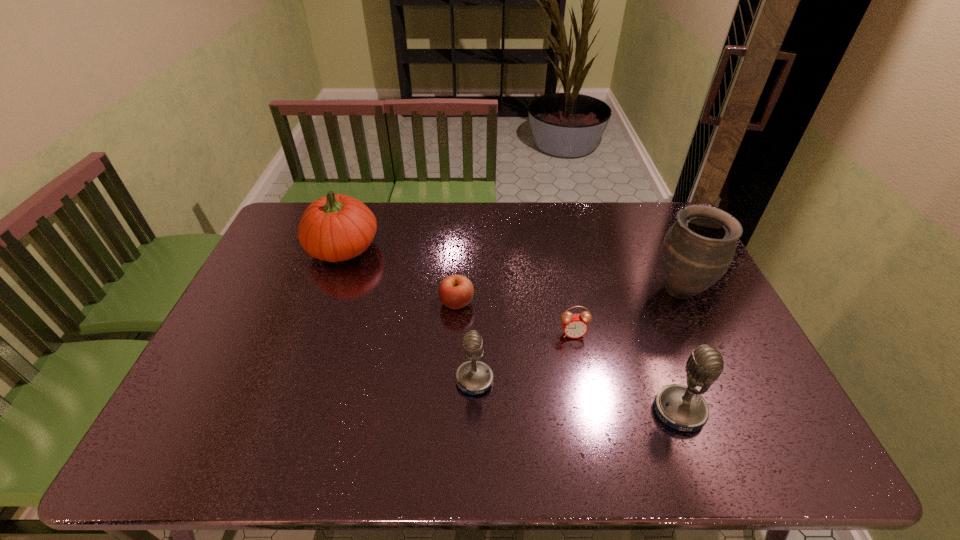
Locate an element on the screen. free space at the far edge of the desktop is located at coordinates (566, 209).

Find the location of `vacant space at the near edge`. vacant space at the near edge is located at coordinates (327, 400).

This screenshot has height=540, width=960. In the image, there is a desktop. Identify the location of vacant space at the left edge. (243, 332).

I want to click on blank space at the right edge of the desktop, so click(x=693, y=326).

Identify the location of empty space between the urn and the right microphone. (680, 350).

You are a GUI agent. You are given a task and a screenshot of the screen. Output one action in this format:
    pyautogui.click(x=<x>, y=<y>)
    Task: Click on the vacant space in between the apple and the alarm clock
    
    Given the screenshot: What is the action you would take?
    pyautogui.click(x=515, y=319)

You are a GUI agent. You are given a task and a screenshot of the screen. Output one action in this format:
    pyautogui.click(x=<x>, y=<y>)
    Task: Click on the free space between the leftmost object and the urn
    
    Given the screenshot: What is the action you would take?
    pyautogui.click(x=512, y=269)

Where is `free space between the urn and the pumpkin`? free space between the urn and the pumpkin is located at coordinates (512, 269).

You are a GUI agent. You are given a task and a screenshot of the screen. Output one action in this format:
    pyautogui.click(x=<x>, y=<y>)
    Task: Click on the free spot between the fourth farthest object and the left microphone
    The image size is (960, 540).
    Given the screenshot: What is the action you would take?
    pyautogui.click(x=524, y=357)

The image size is (960, 540). In order to click on free spot between the fourth tallest object and the leftmost object in this screenshot , I will do `click(409, 314)`.